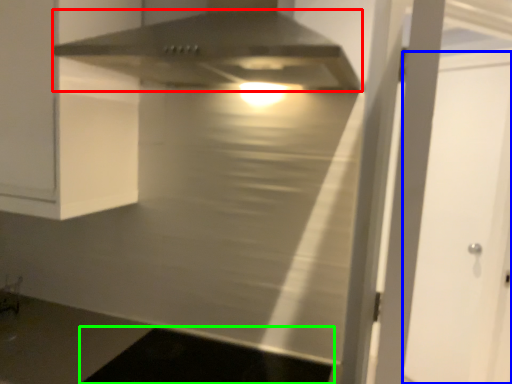
Question: Based on their relative distances, which object is nearer to home appliance (highlighted by a red box)? Choose from glass door (highlighted by a blue box) and dark (highlighted by a green box).

Choices:
 (A) glass door
 (B) dark

Answer: (B)